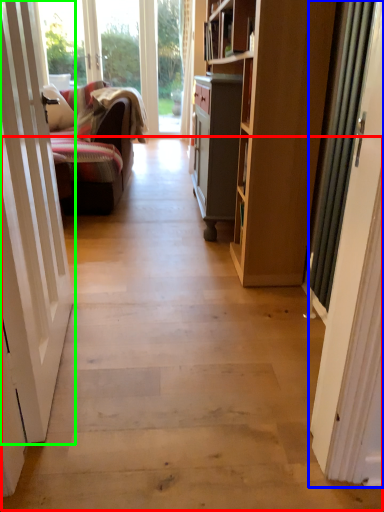
Question: Which object is the farthest from path (highlighted by a red box)? Choose among these: door (highlighted by a blue box) or door (highlighted by a green box).

Choices:
 (A) door
 (B) door

Answer: (A)